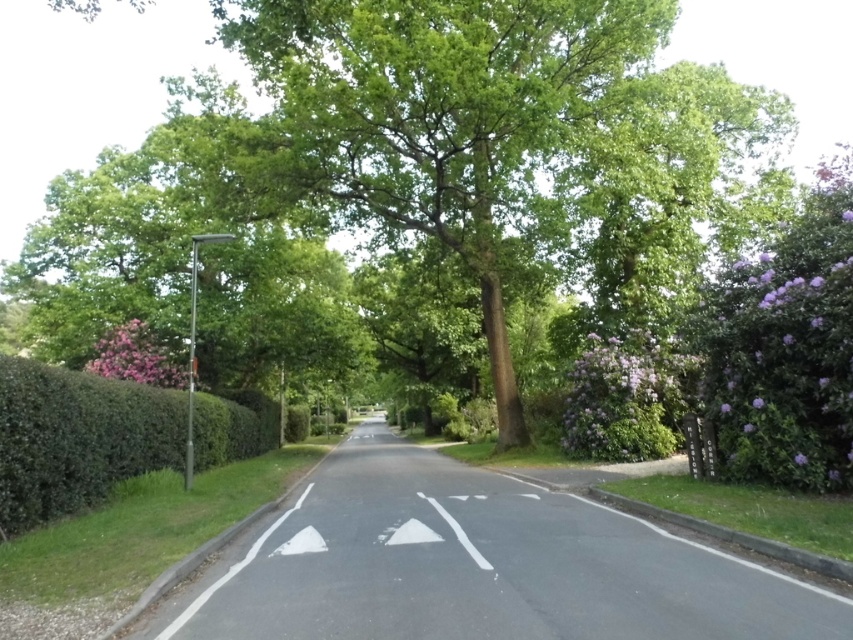
You are a gardener who needs to water both the green leafy tree at center and the purple leafy bush at right. Your watering can has a range of 3 meters. Can you water both plants without moving the watering can?

The distance between the green leafy tree at center and the purple leafy bush at right is 3.78 meters, which is greater than the watering can range of 3 meters. Therefore, you cannot water both plants without moving the watering can.

In the scene shown: You are a gardener who needs to water both the green leafy hedge at left and the purple leafy bush at right. Which one should you water first if you want to start from the closest object to your current position?

The green leafy hedge at left is to the left of the purple leafy bush at right, so if you start from the closest object, you should water the green leafy hedge at left first since it is positioned closer to your current position.

You are a gardener who needs to water both the green leafy hedge at left and the purple leafy bush at right. Based on their positions, which one is closer to the road?

The green leafy hedge at left is closer to the road because it is positioned below the purple leafy bush at right, indicating it is nearer in the scene.